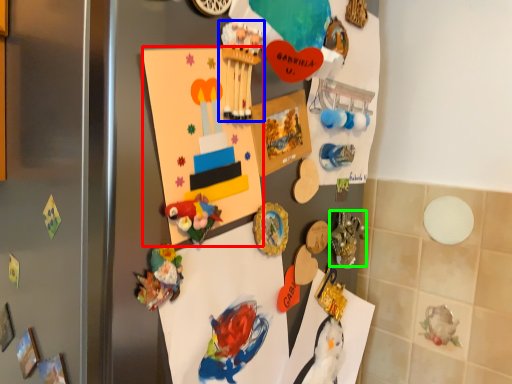
Question: Which is farther away from postcard (highlighted by a red box)? toy (highlighted by a blue box) or art (highlighted by a green box)?

Choices:
 (A) toy
 (B) art

Answer: (B)